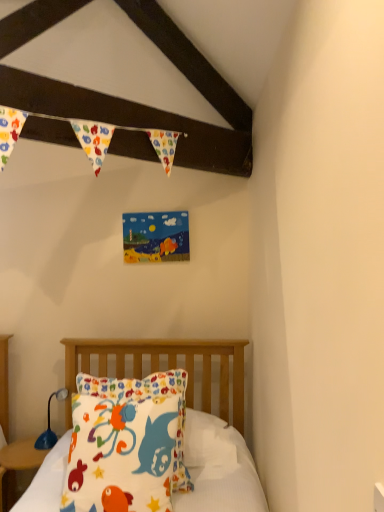
Question: Is fluffy cotton pillow at lower left surrounding blue plastic lamp at lower left?

Choices:
 (A) yes
 (B) no

Answer: (B)

Question: Is fluffy cotton pillow at lower left at the right side of blue plastic lamp at lower left?

Choices:
 (A) yes
 (B) no

Answer: (A)

Question: Considering the relative sizes of fluffy cotton pillow at lower left and blue plastic lamp at lower left in the image provided, is fluffy cotton pillow at lower left taller than blue plastic lamp at lower left?

Choices:
 (A) yes
 (B) no

Answer: (A)

Question: Is fluffy cotton pillow at lower left at the left side of blue plastic lamp at lower left?

Choices:
 (A) no
 (B) yes

Answer: (A)

Question: Considering the relative sizes of fluffy cotton pillow at lower left and blue plastic lamp at lower left in the image provided, is fluffy cotton pillow at lower left smaller than blue plastic lamp at lower left?

Choices:
 (A) yes
 (B) no

Answer: (B)

Question: From the image's perspective, relative to fluffy cotton pillow at lower left, is blue plastic lamp at lower left above or below?

Choices:
 (A) below
 (B) above

Answer: (A)

Question: Is blue plastic lamp at lower left wider or thinner than fluffy cotton pillow at lower left?

Choices:
 (A) wide
 (B) thin

Answer: (B)

Question: Relative to fluffy cotton pillow at lower left, is blue plastic lamp at lower left in front or behind?

Choices:
 (A) behind
 (B) front

Answer: (A)

Question: Which is correct: blue plastic lamp at lower left is inside fluffy cotton pillow at lower left, or outside of it?

Choices:
 (A) inside
 (B) outside

Answer: (B)

Question: In terms of width, does fluffy cotton pillow at lower left look wider or thinner when compared to blue plastic lamp at lower left?

Choices:
 (A) thin
 (B) wide

Answer: (B)

Question: From a real-world perspective, is fluffy cotton pillow at lower left physically located above or below blue plastic lamp at lower left?

Choices:
 (A) below
 (B) above

Answer: (B)

Question: From the image's perspective, is fluffy cotton pillow at lower left located above or below blue plastic lamp at lower left?

Choices:
 (A) above
 (B) below

Answer: (A)

Question: Is fluffy cotton pillow at lower left to the left or to the right of blue plastic lamp at lower left in the image?

Choices:
 (A) left
 (B) right

Answer: (B)

Question: In the image, is fluffy cotton pillow at lower left on the left side or the right side of white cotton pillow at center?

Choices:
 (A) right
 (B) left

Answer: (B)

Question: Is point (104, 457) closer or farther from the camera than point (208, 385)?

Choices:
 (A) closer
 (B) farther

Answer: (A)